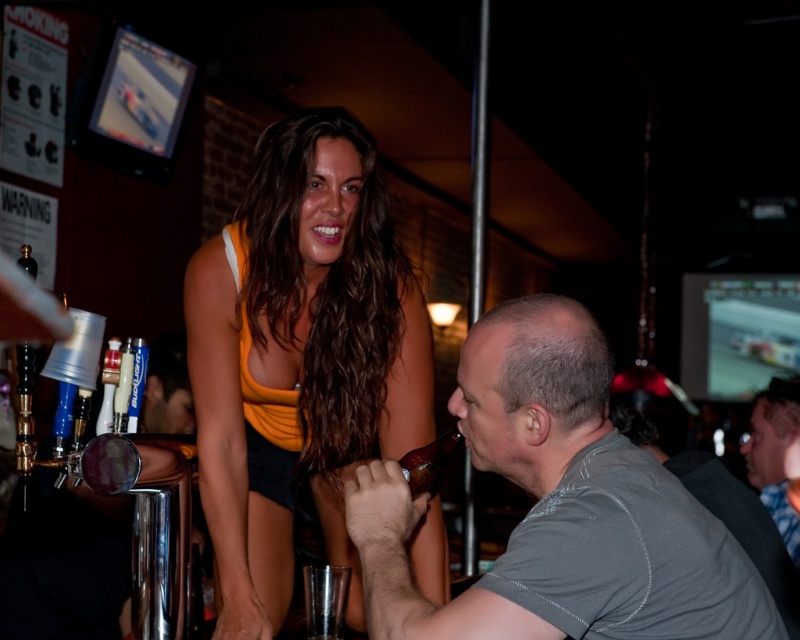
Between point (780, 492) and point (438, 474), which one is positioned behind?

Point (780, 492)

I want to click on gray fabric shirt at upper right, so click(x=776, y=454).

Is yellow fabric bikini top at upper center above brown glass bottle at lower center?

Correct, yellow fabric bikini top at upper center is located above brown glass bottle at lower center.

Is point (241, 262) more distant than point (413, 490)?

That is True.

Who is more distant from viewer, (x=246, y=285) or (x=408, y=468)?

The point (x=246, y=285) is behind.

Find the location of a particular element. yellow fabric bikini top at upper center is located at coordinates (268, 400).

Can you confirm if gray matte shirt at center is positioned below yellow fabric bikini top at upper center?

Correct, gray matte shirt at center is located below yellow fabric bikini top at upper center.

Between gray matte shirt at center and yellow fabric bikini top at upper center, which one appears on the right side from the viewer's perspective?

gray matte shirt at center

This screenshot has width=800, height=640. What do you see at coordinates (558, 506) in the screenshot?
I see `gray matte shirt at center` at bounding box center [558, 506].

Identify the location of gray matte shirt at center. (558, 506).